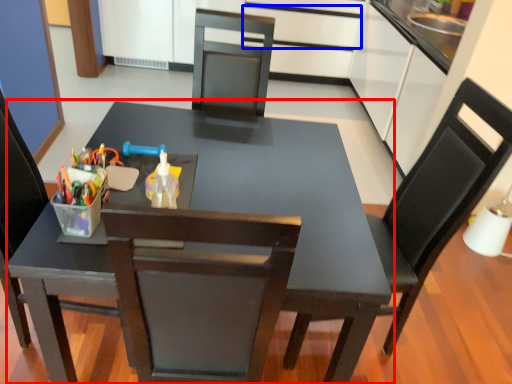
Question: Which of the following is the farthest to the observer, table (highlighted by a red box) or drawer (highlighted by a blue box)?

Choices:
 (A) table
 (B) drawer

Answer: (B)